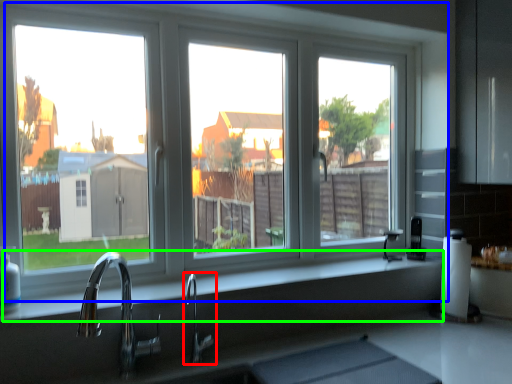
Question: Which object is positioned farthest from tap (highlighted by a red box)? Select from window (highlighted by a blue box) and counter top (highlighted by a green box).

Choices:
 (A) window
 (B) counter top

Answer: (A)